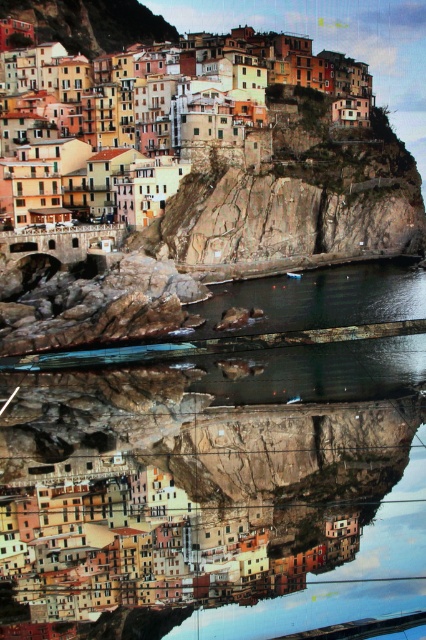
Between transparent glass water at center and multicolored stone buildings at upper center, which one has less height?

transparent glass water at center is shorter.

Measure the distance from transparent glass water at center to multicolored stone buildings at upper center.

transparent glass water at center and multicolored stone buildings at upper center are 188.97 feet apart from each other.

Measure the distance between point (348, 540) and camera.

Point (348, 540) and camera are 269.53 feet apart from each other.

The image size is (426, 640). I want to click on transparent glass water at center, so click(x=247, y=470).